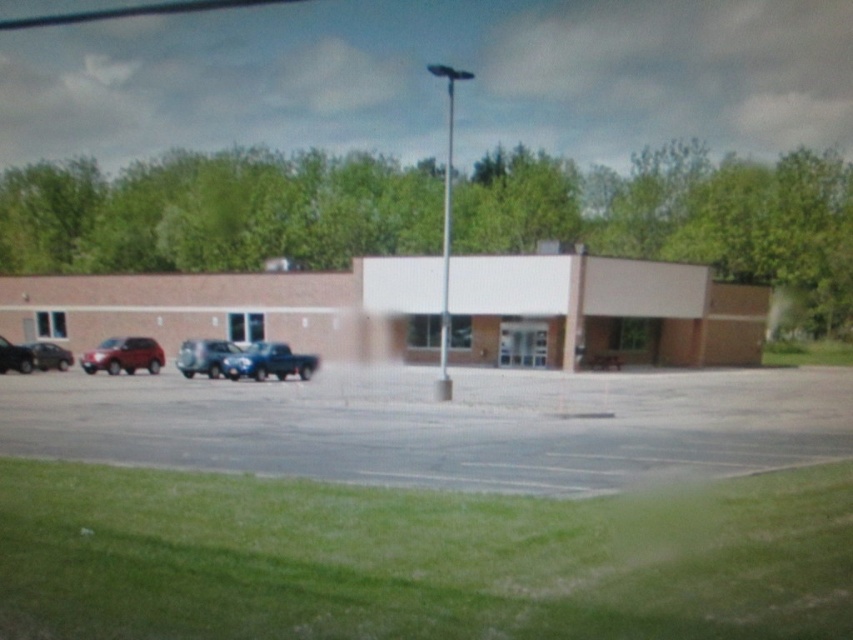
You are a delivery person with a cart that is 2 meters wide. You need to move from the grassy area in front of the building to the entrance. The path between the matte red suv at lower left and the shiny silver sedan at left is the only available route. Can your cart fit through the space between them?

The distance between the matte red suv at lower left and the shiny silver sedan at left is 3.79 meters. Since the cart is 2 meters wide, it can easily pass through the space as there is sufficient width available.

You are a delivery person trying to unload a package from your truck. You need to know if the gray asphalt parking lot at center is lower than the satin silver truck at center. Can you confirm this?

The gray asphalt parking lot at center has a lesser height compared to the satin silver truck at center, so yes, the parking lot is lower than the truck.

You are a delivery driver who needs to back out of the parking spot. You see a metallic blue truck at center and a shiny silver sedan at left. Which vehicle is blocking your path?

The metallic blue truck at center is blocking your path because it is positioned in front of the shiny silver sedan at left, which means it is closer to your current position.